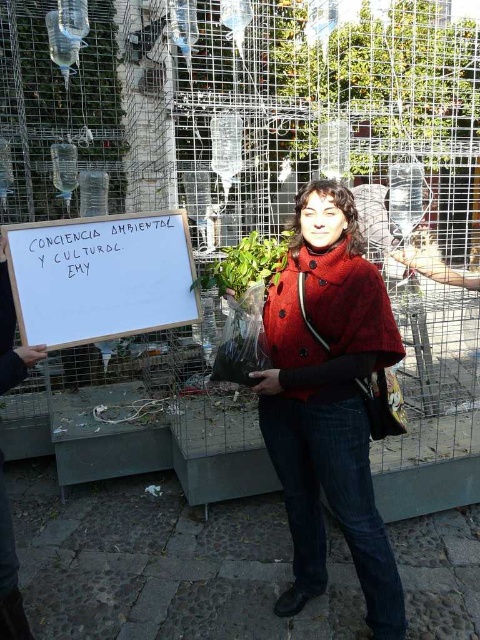
Can you confirm if knitted woolen cape at center is bigger than white wood sign at center?

Yes.

Does knitted woolen cape at center appear over white wood sign at center?

Actually, knitted woolen cape at center is below white wood sign at center.

Measure the distance between point (x=324, y=531) and camera.

Point (x=324, y=531) is 2.47 meters from camera.

Identify the location of knitted woolen cape at center. The width and height of the screenshot is (480, 640). (328, 401).